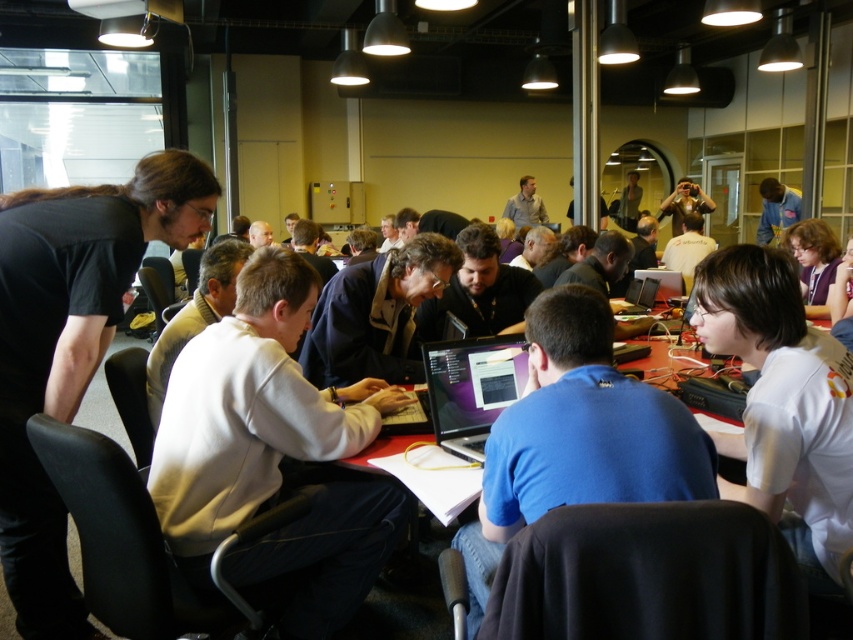
You are standing at the entrance of the room and see two points marked in the image. Which point is closer to you, point (488, 502) or point (851, 312)?

Point (488, 502) is in front of point (851, 312), so it is closer to you.

You are a photographer standing in the room and want to take a photo of the silver metallic laptop at center without including the white cotton shirt at lower right in the frame. Is this possible based on their positions?

The white cotton shirt at lower right is located below the silver metallic laptop at center, so if you position yourself to capture the silver metallic laptop at center from an angle where the lower part of the frame does not include the area below it, you can exclude the white cotton shirt at lower right.